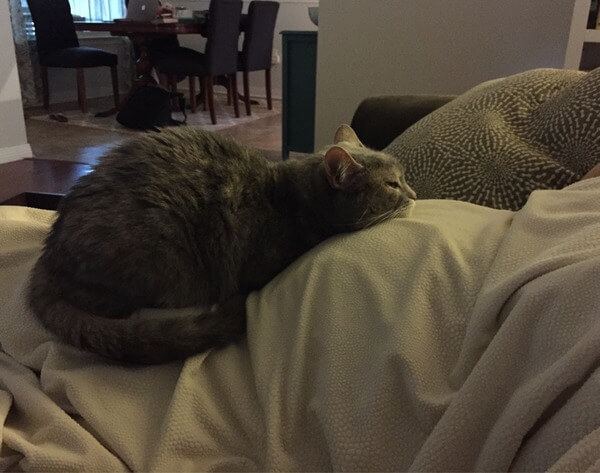
This screenshot has width=600, height=473. Identify the location of window. pyautogui.click(x=89, y=2).